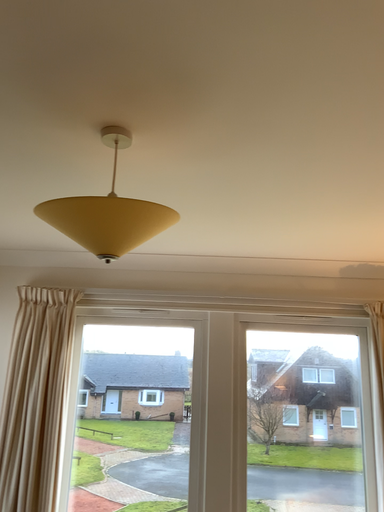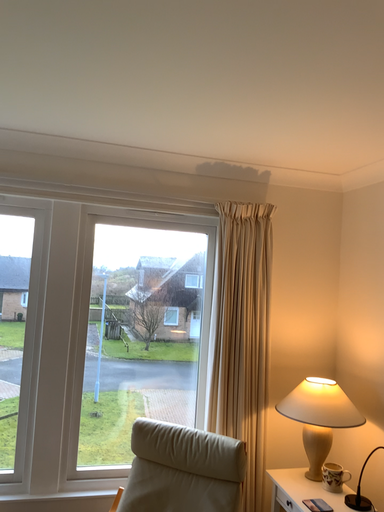
Question: How did the camera likely rotate when shooting the video?

Choices:
 (A) rotated downward
 (B) rotated upward

Answer: (A)